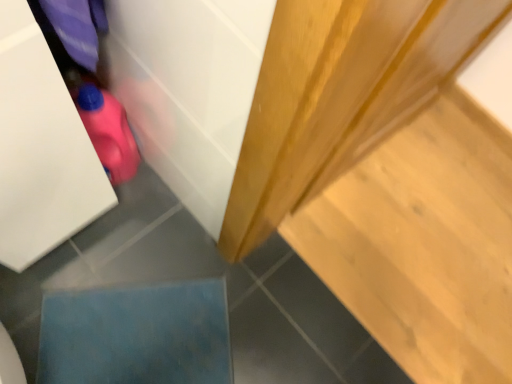
You are a GUI agent. You are given a task and a screenshot of the screen. Output one action in this format:
    pyautogui.click(x=<x>, y=<y>)
    Task: Click on the blue fabric at lower left
    The image size is (512, 384).
    Given the screenshot: What is the action you would take?
    pyautogui.click(x=136, y=335)

At what (x,y) coordinates should I click in order to perform the action: click on light wood stair at upper right. Please return your answer as a coordinate pair (x, y). Image resolution: width=512 pixels, height=384 pixels. Looking at the image, I should click on (424, 243).

Does light wood stair at upper right lie in front of blue fabric at lower left?

That is False.

Is light wood stair at upper right to the left or to the right of blue fabric at lower left in the image?

light wood stair at upper right is positioned on blue fabric at lower left's right side.

From a real-world perspective, is light wood stair at upper right physically located above or below blue fabric at lower left?

From a real-world perspective, light wood stair at upper right is physically below blue fabric at lower left.

Can you confirm if light wood stair at upper right is bigger than blue fabric at lower left?

Yes.

In order to click on stair below the blue fabric at lower left (from a real-world perspective) in this screenshot , I will do `click(424, 243)`.

In the scene shown: Would you say blue fabric at lower left is to the left or to the right of light wood stair at upper right in the picture?

In the image, blue fabric at lower left appears on the left side of light wood stair at upper right.

Does blue fabric at lower left touch light wood stair at upper right?

No.

Is pink rubber toy at lower left looking in the opposite direction of blue fabric at lower left?

pink rubber toy at lower left does not have its back to blue fabric at lower left.

Which object is positioned more to the left, pink rubber toy at lower left or blue fabric at lower left?

Positioned to the left is pink rubber toy at lower left.

How far apart are pink rubber toy at lower left and blue fabric at lower left?

The distance of pink rubber toy at lower left from blue fabric at lower left is 44.48 centimeters.

From the picture: How many degrees apart are the facing directions of pink rubber toy at lower left and blue fabric at lower left?

The angle between the facing direction of pink rubber toy at lower left and the facing direction of blue fabric at lower left is 143 degrees.

Is pink rubber toy at lower left wider or thinner than light wood stair at upper right?

Considering their sizes, pink rubber toy at lower left looks slimmer than light wood stair at upper right.

In the scene shown: How distant is pink rubber toy at lower left from light wood stair at upper right?

They are 34.93 inches apart.

Is light wood stair at upper right at the back of pink rubber toy at lower left?

pink rubber toy at lower left does not have its back to light wood stair at upper right.

From a real-world perspective, is pink rubber toy at lower left over light wood stair at upper right?

Correct, in the physical world, pink rubber toy at lower left is higher than light wood stair at upper right.

Between blue fabric at lower left and pink rubber toy at lower left, which one has smaller size?

blue fabric at lower left is smaller.

Between point (224, 361) and point (86, 121), which one is positioned in front?

Point (86, 121)

Between blue fabric at lower left and pink rubber toy at lower left, which one appears on the right side from the viewer's perspective?

Positioned to the right is blue fabric at lower left.

From the image's perspective, between blue fabric at lower left and pink rubber toy at lower left, which one is located above?

pink rubber toy at lower left is shown above in the image.

Is light wood stair at upper right in contact with pink rubber toy at lower left?

No, light wood stair at upper right is not beside pink rubber toy at lower left.

Does point (415, 288) appear closer or farther from the camera than point (100, 97)?

Point (415, 288) is positioned farther from the camera compared to point (100, 97).

From the image's perspective, is light wood stair at upper right located above or below pink rubber toy at lower left?

Based on their image positions, light wood stair at upper right is located beneath pink rubber toy at lower left.

From a real-world perspective, which is physically above, light wood stair at upper right or pink rubber toy at lower left?

In real-world perspective, pink rubber toy at lower left is above.

Where is `stair below the blue fabric at lower left (from a real-world perspective)`? This screenshot has height=384, width=512. stair below the blue fabric at lower left (from a real-world perspective) is located at coordinates (424, 243).

The image size is (512, 384). What are the coordinates of `stair above the blue fabric at lower left (from the image's perspective)` in the screenshot? It's located at (424, 243).

When comparing their distances from light wood stair at upper right, does blue fabric at lower left or pink rubber toy at lower left seem further?

Among the two, pink rubber toy at lower left is located further to light wood stair at upper right.

Estimate the real-world distances between objects in this image. Which object is closer to pink rubber toy at lower left, light wood stair at upper right or blue fabric at lower left?

blue fabric at lower left is positioned closer to the anchor pink rubber toy at lower left.

When comparing their distances from blue fabric at lower left, does pink rubber toy at lower left or light wood stair at upper right seem further?

light wood stair at upper right lies further to blue fabric at lower left than the other object.

Based on their spatial positions, is blue fabric at lower left or light wood stair at upper right further from pink rubber toy at lower left?

light wood stair at upper right is positioned further to the anchor pink rubber toy at lower left.

Consider the image. Looking at the image, which one is located closer to blue fabric at lower left, light wood stair at upper right or pink rubber toy at lower left?

pink rubber toy at lower left.

Which object lies further to the anchor point light wood stair at upper right, pink rubber toy at lower left or blue fabric at lower left?

pink rubber toy at lower left.

This screenshot has width=512, height=384. Find the location of `square located between pink rubber toy at lower left and light wood stair at upper right in the left-right direction`. square located between pink rubber toy at lower left and light wood stair at upper right in the left-right direction is located at coordinates (136, 335).